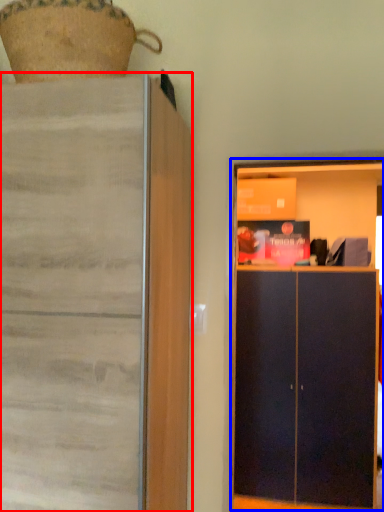
Question: Which object is closer to the camera taking this photo, cupboard (highlighted by a red box) or dresser (highlighted by a blue box)?

Choices:
 (A) cupboard
 (B) dresser

Answer: (A)